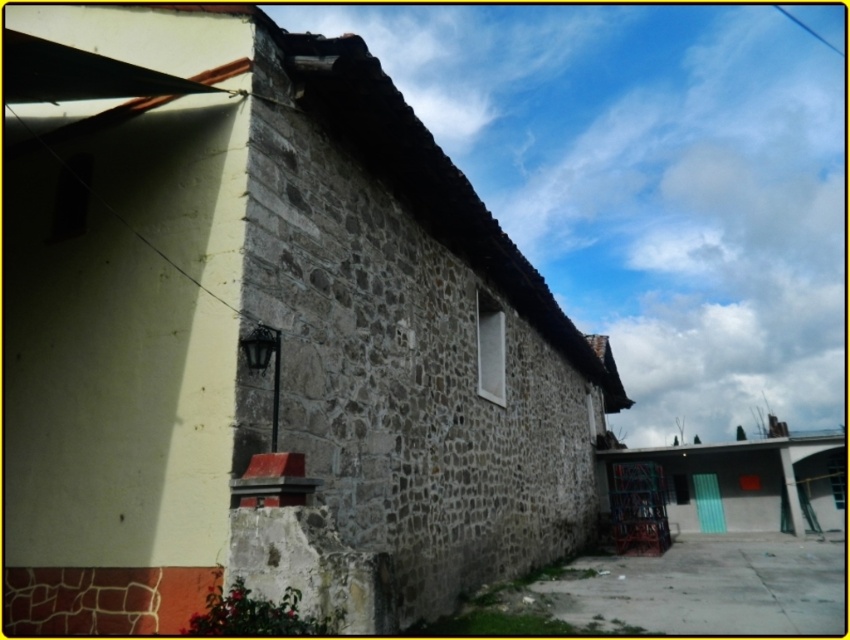
Describe the element at coordinates (265, 339) in the screenshot. This screenshot has height=640, width=850. I see `stone wall at center` at that location.

Can you confirm if stone wall at center is taller than green painted wood hut at lower right?

In fact, stone wall at center may be shorter than green painted wood hut at lower right.

Between point (225, 237) and point (806, 513), which one is positioned behind?

Positioned behind is point (806, 513).

The image size is (850, 640). Find the location of `stone wall at center`. stone wall at center is located at coordinates (265, 339).